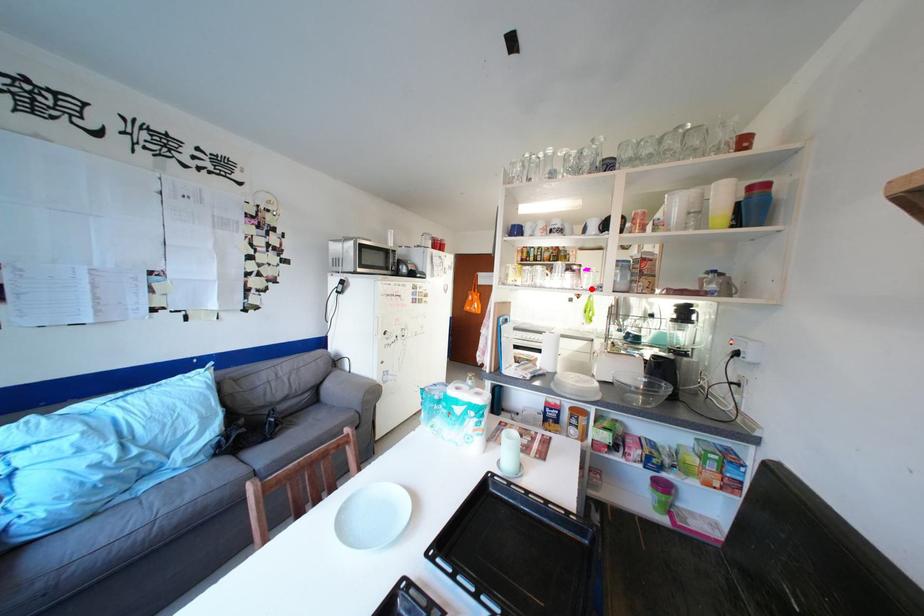
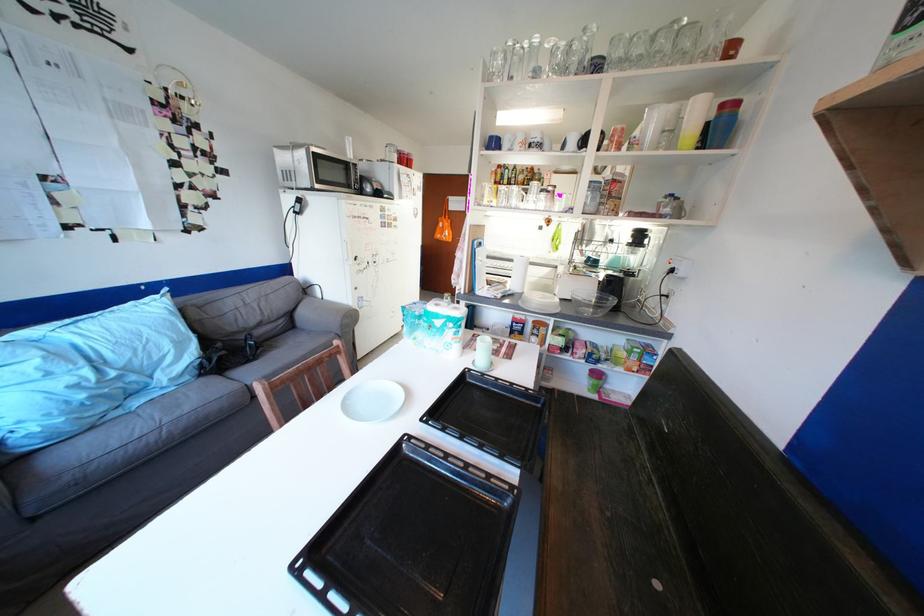
Find the pixel in the second image that matches the highlighted location in the first image.

(564, 212)